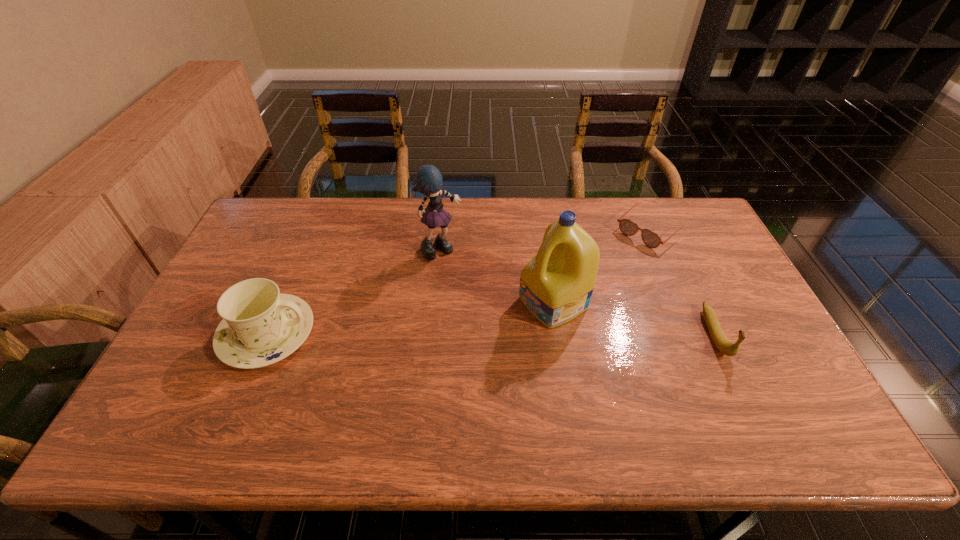
Find the location of `the third shortest object`. the third shortest object is located at coordinates pyautogui.click(x=261, y=326).

At what (x,y) coordinates should I click in order to perform the action: click on chinaware. Please return your answer as a coordinate pair (x, y). This screenshot has width=960, height=540. Looking at the image, I should click on coord(261,326).

You are a GUI agent. You are given a task and a screenshot of the screen. Output one action in this format:
    pyautogui.click(x=<x>, y=<y>)
    Task: Click on the banana
    This screenshot has height=540, width=960.
    Given the screenshot: What is the action you would take?
    pyautogui.click(x=720, y=340)

You are a GUI agent. You are given a task and a screenshot of the screen. Output one action in this format:
    pyautogui.click(x=<x>, y=<y>)
    Task: Click on the shortest object
    The height and width of the screenshot is (540, 960).
    Given the screenshot: What is the action you would take?
    pyautogui.click(x=651, y=239)

Where is `the third object from right to left`? This screenshot has width=960, height=540. the third object from right to left is located at coordinates tap(556, 285).

I want to click on rag doll, so click(428, 180).

Locate an element on the screen. The image size is (960, 540). vacant space located 0.290m on the handle side of the chinaware is located at coordinates click(420, 334).

Where is `vacant space located at the stem of the second shortest object`? The width and height of the screenshot is (960, 540). vacant space located at the stem of the second shortest object is located at coordinates (738, 384).

Locate an element on the screen. The width and height of the screenshot is (960, 540). vacant area situated 0.250m on the front-facing side of the sunglasses is located at coordinates (587, 284).

The height and width of the screenshot is (540, 960). What are the coordinates of `vacant area situated on the front-facing side of the sunglasses` in the screenshot? It's located at (560, 307).